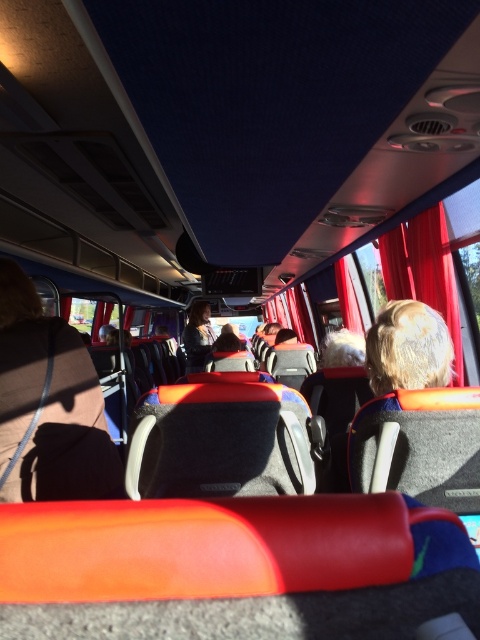
Question: Which object appears closest to the camera in this image?

Choices:
 (A) blonde hair at upper right
 (B) brown leather coach at lower left

Answer: (B)

Question: Which point is closer to the camera?

Choices:
 (A) (22, 360)
 (B) (420, 365)

Answer: (A)

Question: Among these objects, which one is farthest from the camera?

Choices:
 (A) brown leather coach at lower left
 (B) dark blue fabric jacket at center
 (C) blonde hair at upper right

Answer: (B)

Question: Where is red fabric curtain at upper right located in relation to dark blue fabric jacket at center in the image?

Choices:
 (A) left
 (B) right

Answer: (B)

Question: Is red fabric curtain at upper right above dark blue fabric jacket at center?

Choices:
 (A) no
 (B) yes

Answer: (B)

Question: Can you confirm if red fabric curtain at upper right is positioned to the left of blonde hair at upper right?

Choices:
 (A) no
 (B) yes

Answer: (A)